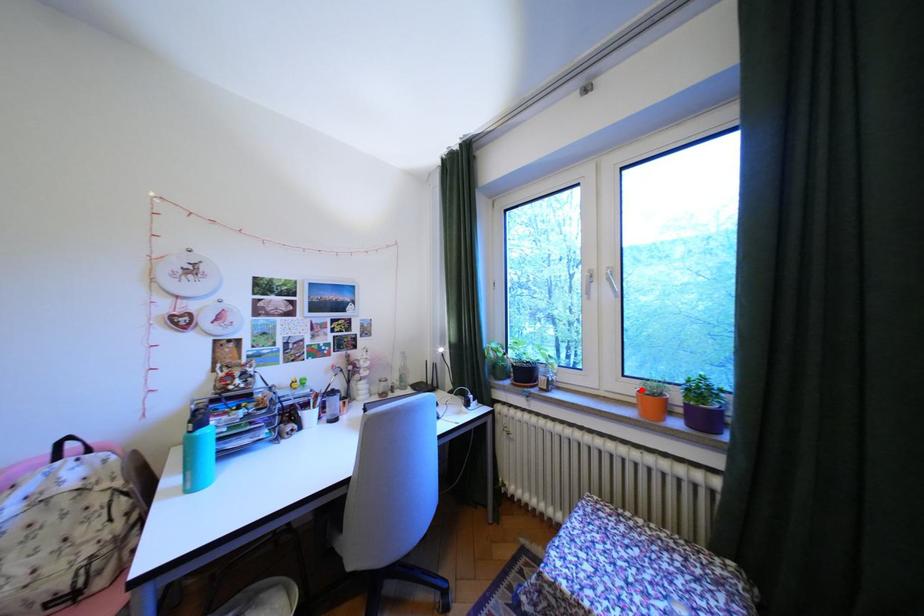
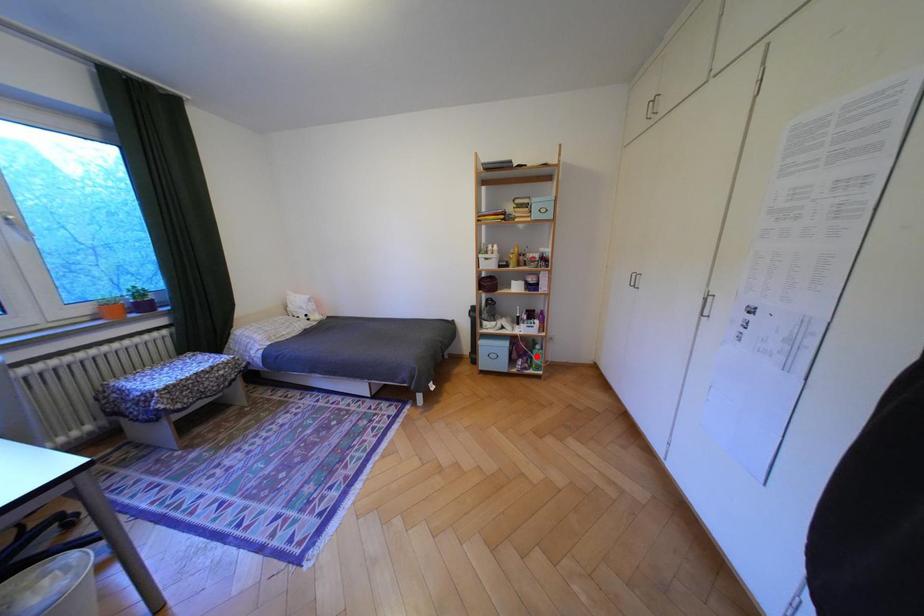
I am providing you with two images of the same scene from different viewpoints. A red point is marked on the first image and another point is marked on the second image. Are the points marked in image1 and image2 representing the same 3D position?

No